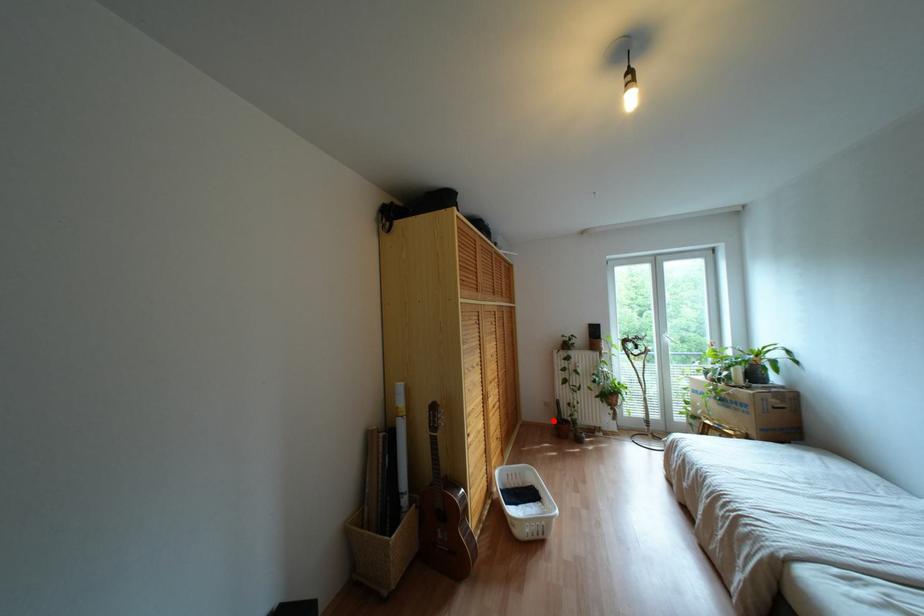
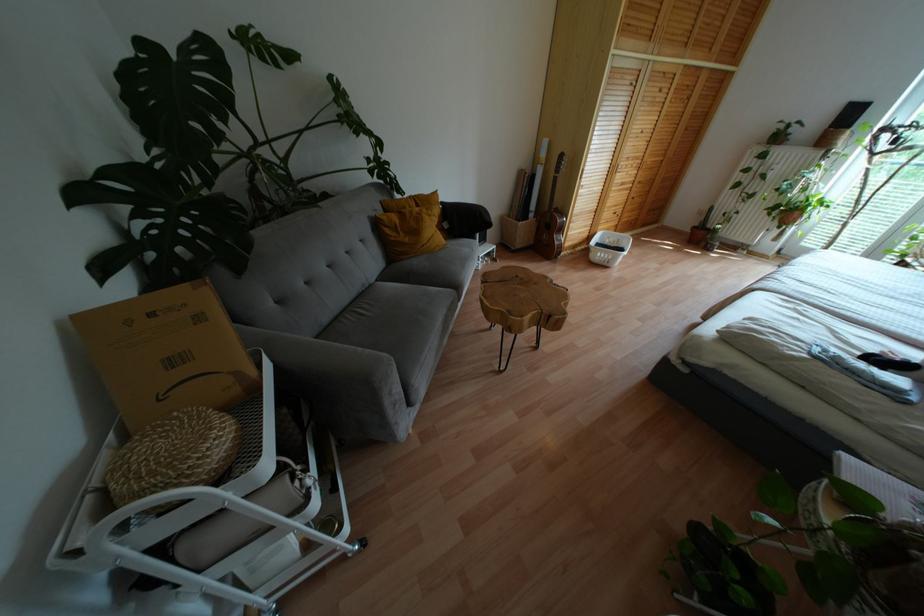
The point at the highlighted location is marked in the first image. Where is the corresponding point in the second image?

(694, 227)